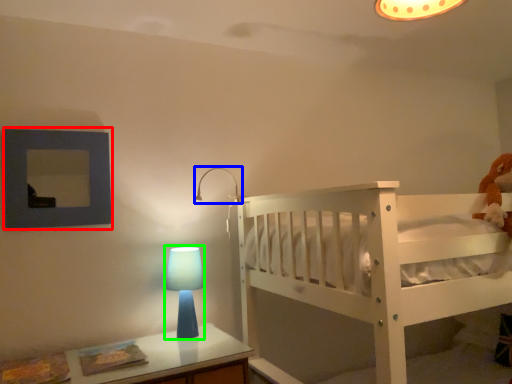
Question: Considering the real-world distances, which object is closest to picture frame (highlighted by a red box)? lamp (highlighted by a blue box) or table lamp (highlighted by a green box).

Choices:
 (A) lamp
 (B) table lamp

Answer: (B)